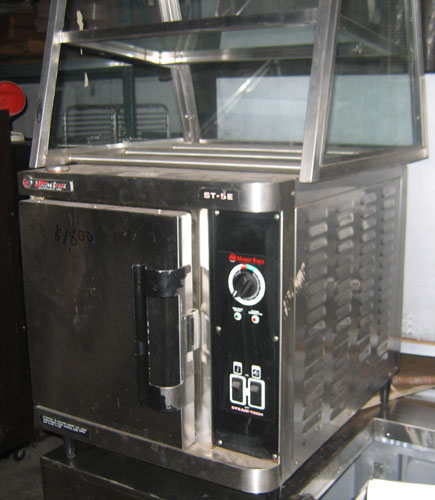
At what (x,y) coordinates should I click in order to perform the action: click on front glass of case. Please return your answer as a coordinate pair (x, y). This screenshot has height=500, width=435. Looking at the image, I should click on (238, 102).